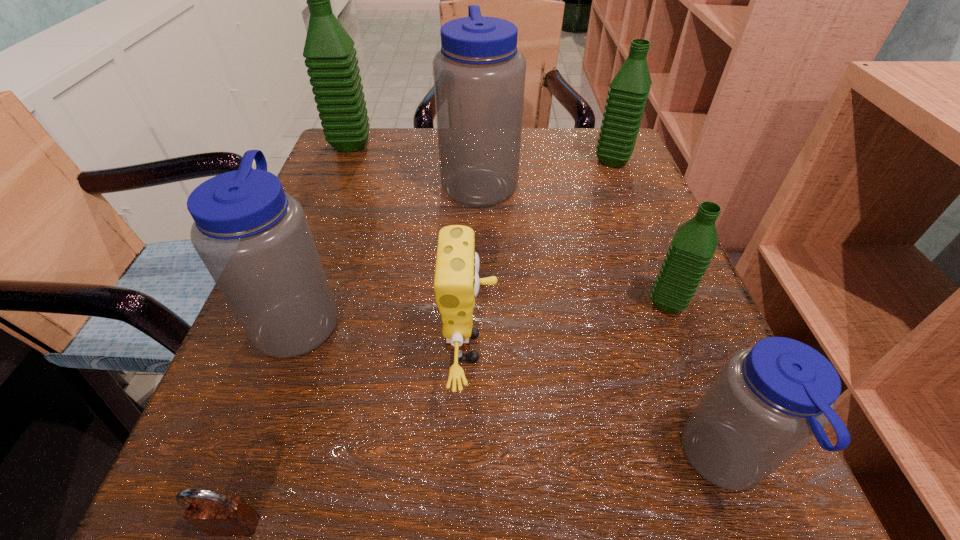
Image resolution: width=960 pixels, height=540 pixels. In order to click on vacant space situated 0.110m with a carrying loop on the side of the nearest blue water bottle in this screenshot , I will do `click(588, 462)`.

The width and height of the screenshot is (960, 540). Identify the location of water bottle situated at the near edge. (770, 400).

This screenshot has width=960, height=540. In order to click on padlock located at the near edge in this screenshot , I will do `click(216, 514)`.

The width and height of the screenshot is (960, 540). In order to click on padlock at the left edge in this screenshot , I will do `click(216, 514)`.

You are a GUI agent. You are given a task and a screenshot of the screen. Output one action in this format:
    pyautogui.click(x=<x>, y=<y>)
    Task: Click on the object that is at the far left corner
    This screenshot has width=960, height=540.
    Given the screenshot: What is the action you would take?
    pyautogui.click(x=330, y=55)

Identify the location of object located in the near left corner section of the desktop. (216, 514).

The width and height of the screenshot is (960, 540). What are the coordinates of `object located at the far right corner` in the screenshot? It's located at (628, 93).

Where is `object located at the near right corner`? The width and height of the screenshot is (960, 540). object located at the near right corner is located at coordinates (770, 400).

At what (x,y) coordinates should I click in order to perform the action: click on vacant area at the far edge. Please return your answer as a coordinate pair (x, y). The image size is (960, 540). Looking at the image, I should click on (430, 181).

Locate an element on the screen. free space at the near edge of the desktop is located at coordinates (495, 457).